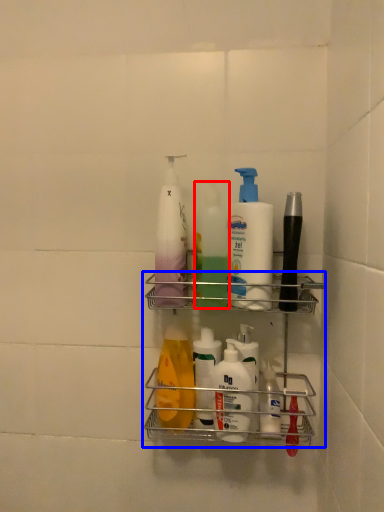
Question: Which object is further to the camera taking this photo, cleaning product (highlighted by a red box) or shelf (highlighted by a blue box)?

Choices:
 (A) cleaning product
 (B) shelf

Answer: (A)